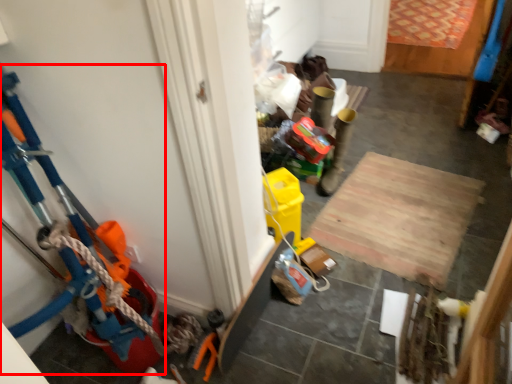
Question: Observing the image, what is the correct spatial positioning of toy (annotated by the red box) in reference to plywood?

Choices:
 (A) left
 (B) right

Answer: (A)